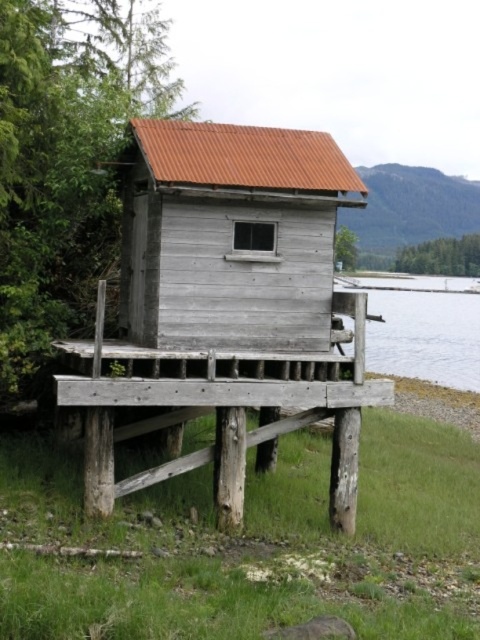
You are standing in front of two structures, the weathered wood hut at center and the weathered wood cabin at center. Which one appears nearer to you?

The weathered wood hut at center is closer to the viewer than the weathered wood cabin at center.

You are standing at the edge of the water and want to reach the weathered wood cabin at center. Which direction should you move to get closer to the cabin while avoiding the clear water at lower right?

Since the clear water at lower right is behind the weathered wood cabin at center, you should move towards the cabin from the direction opposite the water. This means moving away from the clear water at lower right and towards the cabin, ensuring you don not step into the water.